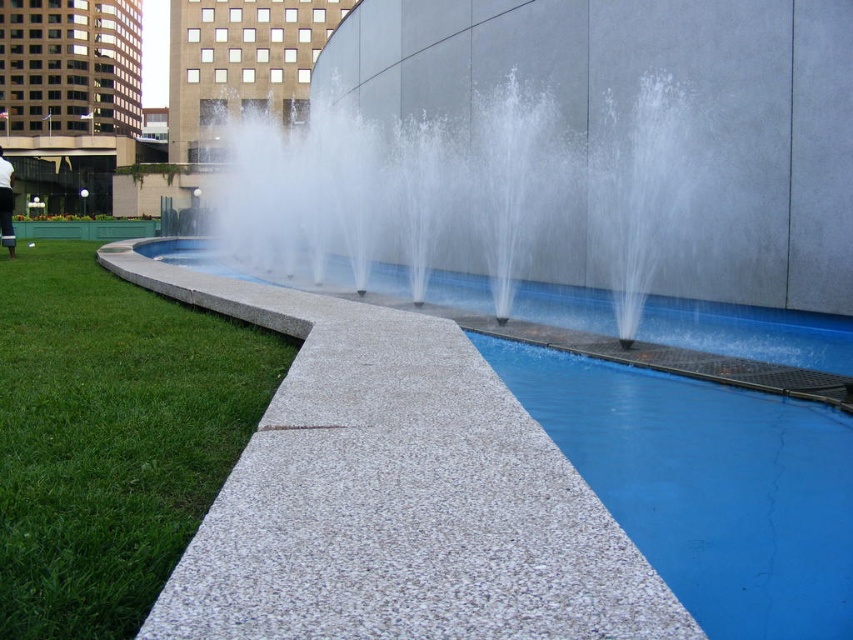
Can you confirm if green grass at lower left is thinner than clear glass water at center?

Correct, green grass at lower left's width is less than clear glass water at center's.

Is green grass at lower left positioned before clear glass water at center?

That is True.

Between point (86, 385) and point (596, 196), which one is positioned in front?

Point (86, 385) is in front.

Where is `green grass at lower left`? This screenshot has width=853, height=640. green grass at lower left is located at coordinates (109, 436).

Who is shorter, green grass at lower left or blue speckled concrete pool at lower right?

green grass at lower left is shorter.

Is point (183, 480) in front of point (827, 618)?

No.

In order to click on green grass at lower left in this screenshot , I will do click(109, 436).

Where is `green grass at lower left`? green grass at lower left is located at coordinates (109, 436).

Which is above, clear glass water at center or white cotton shirt at lower left?

clear glass water at center

Measure the distance between point (248, 144) and camera.

Point (248, 144) and camera are 12.73 meters apart from each other.

Does point (271, 216) come closer to viewer compared to point (3, 179)?

No, (271, 216) is further to viewer.

At what (x,y) coordinates should I click in order to perform the action: click on clear glass water at center. Please return your answer as a coordinate pair (x, y). Looking at the image, I should click on (463, 193).